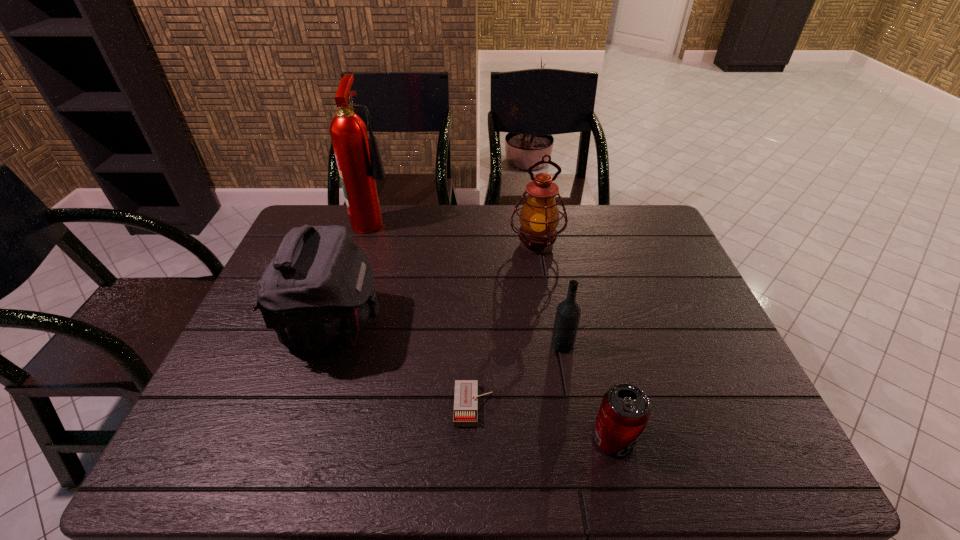
The height and width of the screenshot is (540, 960). Find the location of `vacant space at the right edge of the desktop`. vacant space at the right edge of the desktop is located at coordinates (706, 368).

Where is `blank area at the near left corner`? Image resolution: width=960 pixels, height=540 pixels. blank area at the near left corner is located at coordinates (188, 461).

The width and height of the screenshot is (960, 540). I want to click on vacant space at the far right corner of the desktop, so click(x=628, y=228).

The height and width of the screenshot is (540, 960). I want to click on free point between the fourth tallest object and the oil lamp, so click(x=549, y=294).

Where is `vacant space that is in between the oil lamp and the vodka`? vacant space that is in between the oil lamp and the vodka is located at coordinates (549, 294).

Locate an element on the screen. vacant point located between the third shortest object and the shortest object is located at coordinates (518, 375).

The image size is (960, 540). Identify the location of free space between the fourth tallest object and the shoulder bag. (448, 335).

I want to click on free spot between the shoulder bag and the vodka, so click(x=448, y=335).

This screenshot has width=960, height=540. Find the location of `free area in between the shoulder bag and the vodka`. free area in between the shoulder bag and the vodka is located at coordinates (448, 335).

The height and width of the screenshot is (540, 960). In order to click on vacant space that's between the oil lamp and the fire extinguisher in this screenshot , I will do tap(456, 232).